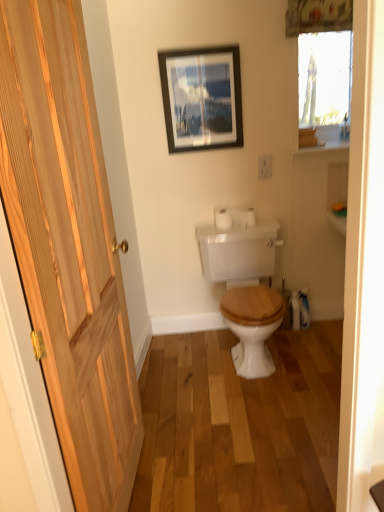
Find the location of a particular element. The image size is (384, 512). spots to the right of white matte toilet paper at center is located at coordinates (260, 226).